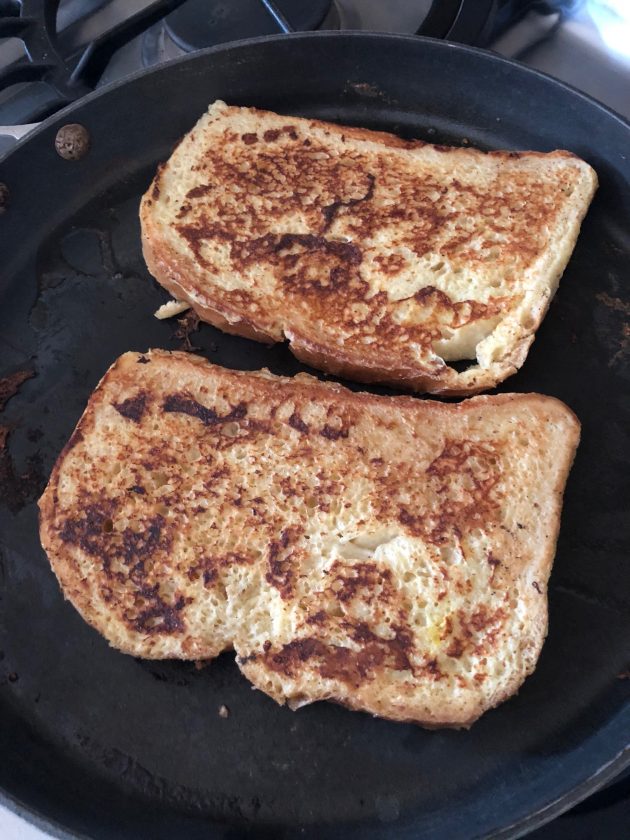
Identify the location of rim of frying pan. (503, 60), (11, 805), (557, 804), (212, 45).